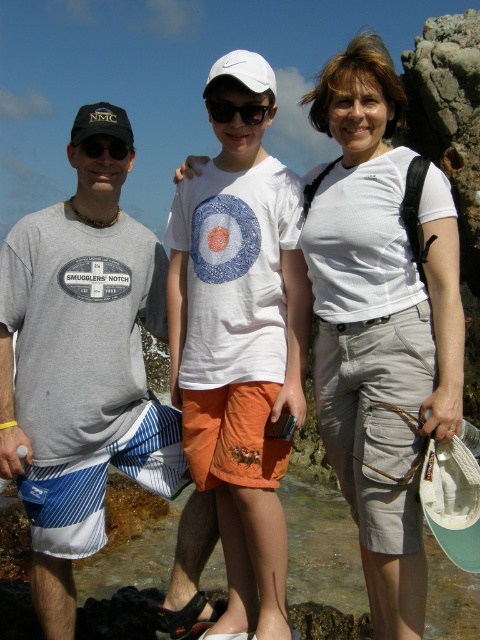
You are standing at the point labeled as point [264,492] and want to take a photo of the rocky shoreline. The camera you have can focus on objects up to 40 meters away. Will the camera be able to capture the shoreline clearly?

The distance between point [264,492] and the camera is 37.58 meters, which is within the camera maximum focus range of 40 meters. Therefore, the camera can capture the shoreline clearly.